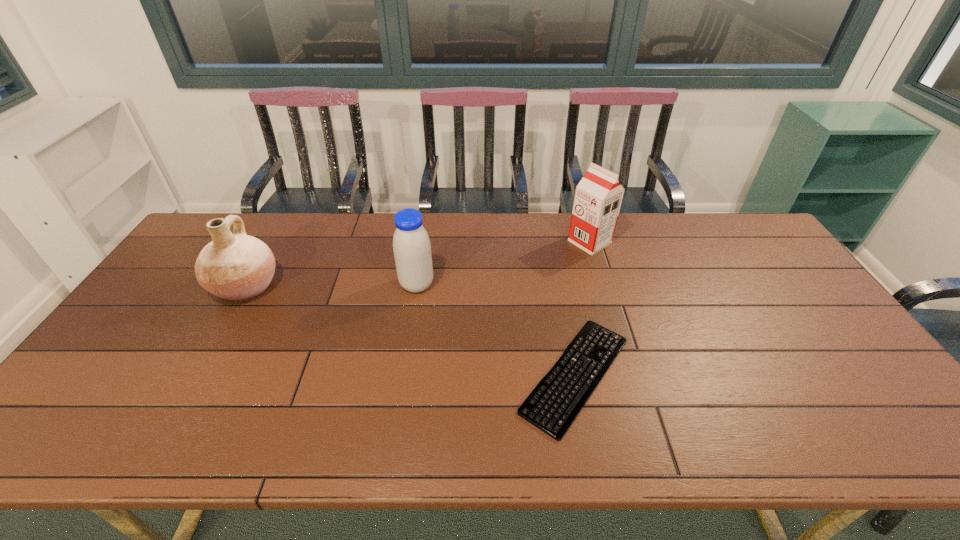
Identify the location of free space between the second object from left to right and the leftmost object. (331, 286).

You are a GUI agent. You are given a task and a screenshot of the screen. Output one action in this format:
    pyautogui.click(x=<x>, y=<y>)
    Task: Click on the vacant area that lies between the second object from left to right and the computer keyboard
    
    Given the screenshot: What is the action you would take?
    pyautogui.click(x=496, y=330)

This screenshot has width=960, height=540. I want to click on vacant space that's between the nearest object and the right soya milk, so click(x=583, y=308).

The width and height of the screenshot is (960, 540). Identify the location of vacant area that lies between the nearer soya milk and the nearest object. (496, 330).

Locate an element on the screen. Image resolution: width=960 pixels, height=540 pixels. empty space that is in between the shortest object and the farthest object is located at coordinates (583, 308).

Locate which object ranks in proximity to the farther soya milk. Please provide its 2D coordinates. Your answer should be formatted as a tuple, i.e. [(x, y)], where the tuple contains the x and y coordinates of a point satisfying the conditions above.

[(553, 405)]

Locate an element on the screen. This screenshot has height=540, width=960. the closest object to the leftmost object is located at coordinates (411, 245).

Find the location of `free location that satisfies the following two spatial constraints: 1. on the front side of the farther soya milk; 2. to pour from the handle of the leftmost object`. free location that satisfies the following two spatial constraints: 1. on the front side of the farther soya milk; 2. to pour from the handle of the leftmost object is located at coordinates (603, 286).

Where is `free location that satisfies the following two spatial constraints: 1. on the front side of the farthest object; 2. to pour from the handle of the leftmost object`? This screenshot has height=540, width=960. free location that satisfies the following two spatial constraints: 1. on the front side of the farthest object; 2. to pour from the handle of the leftmost object is located at coordinates (603, 286).

This screenshot has height=540, width=960. Find the location of `vacant area in the image that satisfies the following two spatial constraints: 1. on the back side of the nearest object; 2. to pour from the handle of the pottery`. vacant area in the image that satisfies the following two spatial constraints: 1. on the back side of the nearest object; 2. to pour from the handle of the pottery is located at coordinates (559, 286).